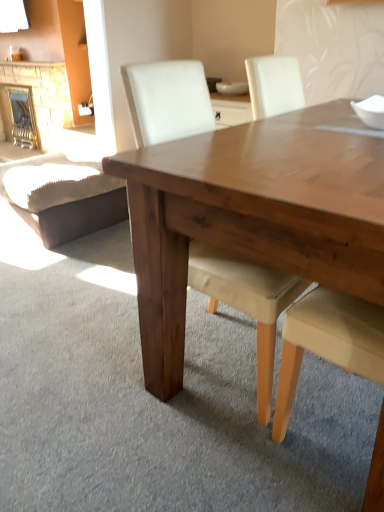
Question: Considering the positions of brick fireplace at left, the 1th fireplace from the right, and white glossy bowl at upper right, the first bowl in the bottom-to-top sequence, in the image, is brick fireplace at left, the 1th fireplace from the right, bigger or smaller than white glossy bowl at upper right, the first bowl in the bottom-to-top sequence,?

Choices:
 (A) small
 (B) big

Answer: (B)

Question: Is brick fireplace at left, the 1th fireplace from the right, in front of or behind white glossy bowl at upper right, the first bowl in the bottom-to-top sequence, in the image?

Choices:
 (A) behind
 (B) front

Answer: (A)

Question: Based on their relative distances, which object is nearer to the white glossy bowl at center, marked as the 1th bowl in a left-to-right arrangement?

Choices:
 (A) brick fireplace at left, the second fireplace when ordered from right to left
 (B) brown leather swivel chair at lower left
 (C) matte white chair at center
 (D) brick fireplace at left, which appears as the 2th fireplace when viewed from the left
 (E) white glossy bowl at upper right, which is counted as the first bowl, starting from the right

Answer: (B)

Question: Which is farther from the matte white chair at center?

Choices:
 (A) white glossy bowl at center, marked as the 2th bowl in a right-to-left arrangement
 (B) white glossy bowl at upper right, the first bowl in the bottom-to-top sequence
 (C) brick fireplace at left, placed as the 1th fireplace when sorted from left to right
 (D) brick fireplace at left, which appears as the 2th fireplace when viewed from the left
 (E) brown leather swivel chair at lower left

Answer: (D)